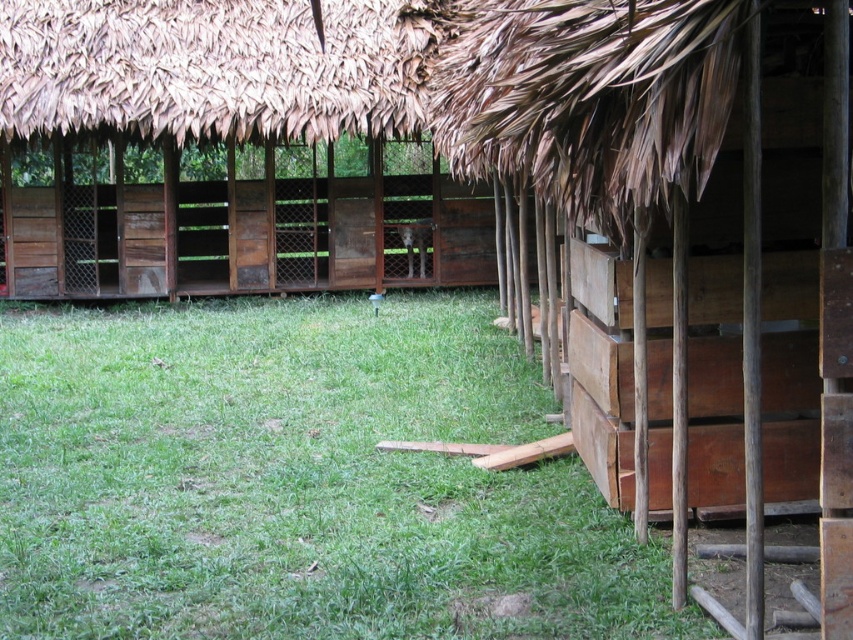
Question: Among these objects, which one is nearest to the camera?

Choices:
 (A) wooden crates at center
 (B) green grass at center

Answer: (A)

Question: Can you confirm if green grass at center is positioned to the left of wooden crates at center?

Choices:
 (A) yes
 (B) no

Answer: (A)

Question: Which is farther from the green grass at center?

Choices:
 (A) wooden crates at center
 (B) brown thatch roof at upper center

Answer: (B)

Question: Among these objects, which one is farthest from the camera?

Choices:
 (A) wooden crates at center
 (B) brown thatch roof at upper center

Answer: (B)

Question: From the image, what is the correct spatial relationship of green grass at center in relation to wooden crates at center?

Choices:
 (A) below
 (B) above

Answer: (A)

Question: Is the position of green grass at center more distant than that of brown thatch roof at upper center?

Choices:
 (A) no
 (B) yes

Answer: (A)